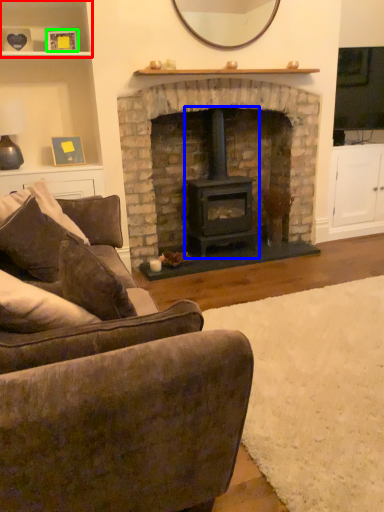
Question: Which object is positioned closest to shelf (highlighted by a red box)? Select from wood burning stove (highlighted by a blue box) and picture frame (highlighted by a green box).

Choices:
 (A) wood burning stove
 (B) picture frame

Answer: (B)